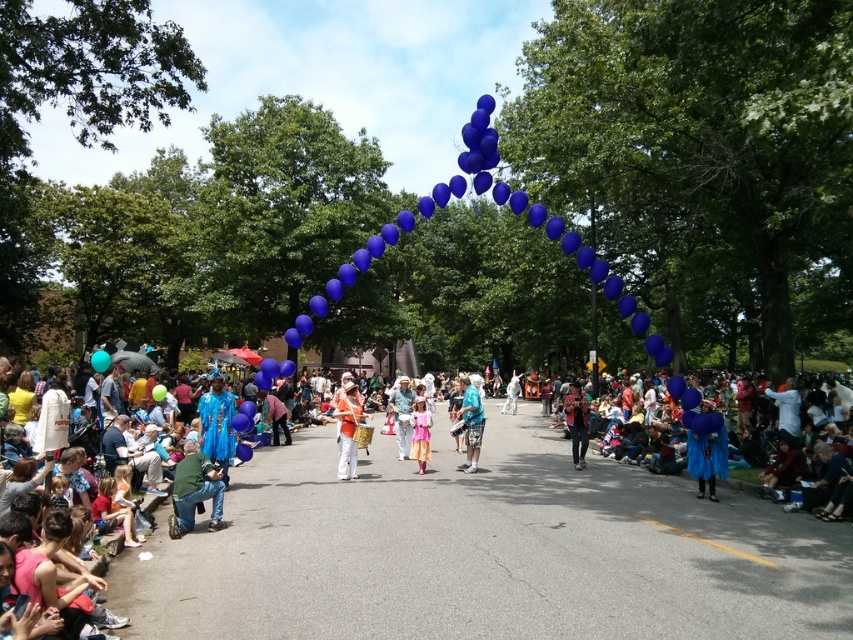
Measure the distance between blue fabric crowd at right and blue fabric skirt at center.

blue fabric crowd at right and blue fabric skirt at center are 1.89 meters apart.

Does blue fabric crowd at right appear over blue fabric skirt at center?

Actually, blue fabric crowd at right is below blue fabric skirt at center.

Between point (838, 460) and point (712, 461), which one is positioned in front?

Point (838, 460)

This screenshot has width=853, height=640. Find the location of `blue fabric crowd at right`. blue fabric crowd at right is located at coordinates (827, 486).

Between matte orange drum at center and pink satin dress at center, which one appears on the right side from the viewer's perspective?

pink satin dress at center is more to the right.

Between point (343, 480) and point (415, 428), which one is positioned in front?

Positioned in front is point (343, 480).

This screenshot has width=853, height=640. I want to click on matte orange drum at center, so click(x=347, y=429).

The image size is (853, 640). What are the coordinates of `matte orange drum at center` in the screenshot? It's located at (347, 429).

Can you confirm if blue fabric costume at center is wider than blue fabric balloon at center?

Correct, the width of blue fabric costume at center exceeds that of blue fabric balloon at center.

Can you confirm if blue fabric costume at center is bigger than blue fabric balloon at center?

No, blue fabric costume at center is not bigger than blue fabric balloon at center.

Is point (581, 444) closer to camera compared to point (515, 387)?

Yes, point (581, 444) is in front of point (515, 387).

Find the location of a particular element. The height and width of the screenshot is (640, 853). blue fabric costume at center is located at coordinates (576, 422).